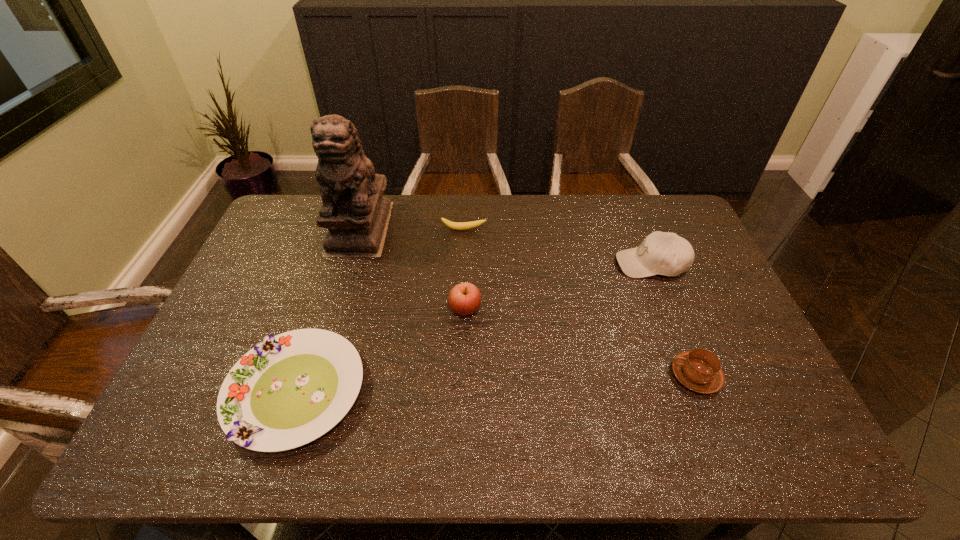
At what (x,y) coordinates should I click in order to perform the action: click on object that is at the left edge. Please return your answer as a coordinate pair (x, y). The height and width of the screenshot is (540, 960). Looking at the image, I should click on (289, 390).

The image size is (960, 540). What are the coordinates of `baseball cap that is positioned at the right edge` in the screenshot? It's located at (665, 253).

Locate an element on the screen. The height and width of the screenshot is (540, 960). cappuccino at the right edge is located at coordinates (699, 370).

Find the location of a particular element. This screenshot has width=960, height=540. object present at the near left corner is located at coordinates (289, 390).

Locate an element on the screen. The image size is (960, 540). vacant space at the far edge of the desktop is located at coordinates [576, 225].

This screenshot has height=540, width=960. Identify the location of free space at the near edge of the desktop. (602, 461).

Find the location of a particular element. vacant region at the left edge of the desktop is located at coordinates (290, 250).

The image size is (960, 540). Identify the location of blank space at the right edge of the desktop. (732, 299).

Identify the location of vacant position at the near left corner of the desktop. (184, 447).

Where is `blank region between the sculpture and the banana`? Image resolution: width=960 pixels, height=540 pixels. blank region between the sculpture and the banana is located at coordinates (412, 229).